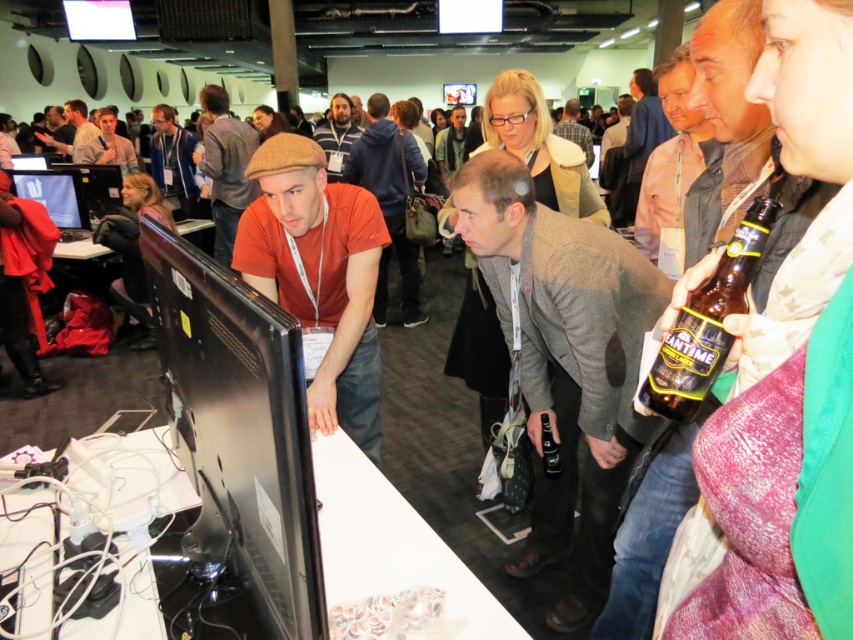
Question: Which object is closer to the camera taking this photo?

Choices:
 (A) black glossy monitor at center
 (B) light brown leather jacket at center
 (C) dark brown leather jacket at center
 (D) plaid shirt at center

Answer: (A)

Question: Is gray wool sweater at center positioned at the back of translucent plastic bottle at center?

Choices:
 (A) yes
 (B) no

Answer: (B)

Question: Which of the following is the farthest from the observer?

Choices:
 (A) (78, 208)
 (B) (172, 138)

Answer: (B)

Question: Observing the image, what is the correct spatial positioning of black glossy monitor at center in reference to gray wool sweater at center?

Choices:
 (A) right
 (B) left

Answer: (B)

Question: Which of the following is the farthest from the observer?

Choices:
 (A) (575, 496)
 (B) (83, 211)
 (C) (753, 234)
 (D) (544, 467)

Answer: (B)

Question: Does dark amber glass bottle at upper right have a smaller size compared to brown woolen cap at upper center?

Choices:
 (A) no
 (B) yes

Answer: (B)